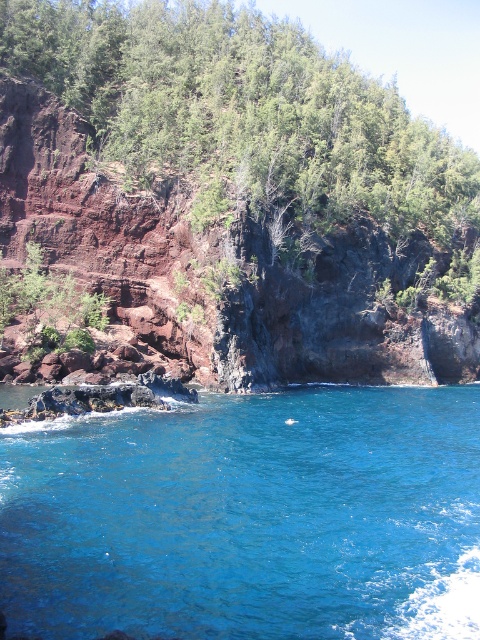
You are standing at the edge of the cliff in the coastal landscape. You see the blue liquid water at center. Can you confirm if the blue liquid water at center is exactly at the point specified by coordinates (248, 516)?

The blue liquid water at center is located at point (248, 516), so yes, it is exactly at that coordinate.